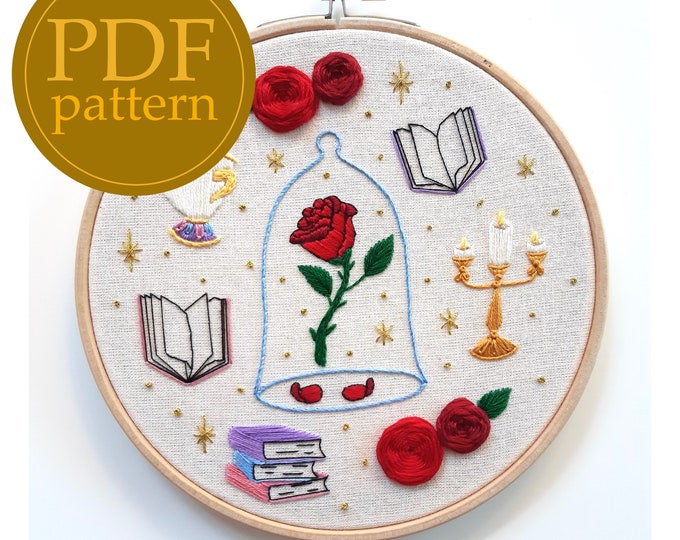
What are the coordinates of `purple book` in the screenshot? It's located at (256, 436).